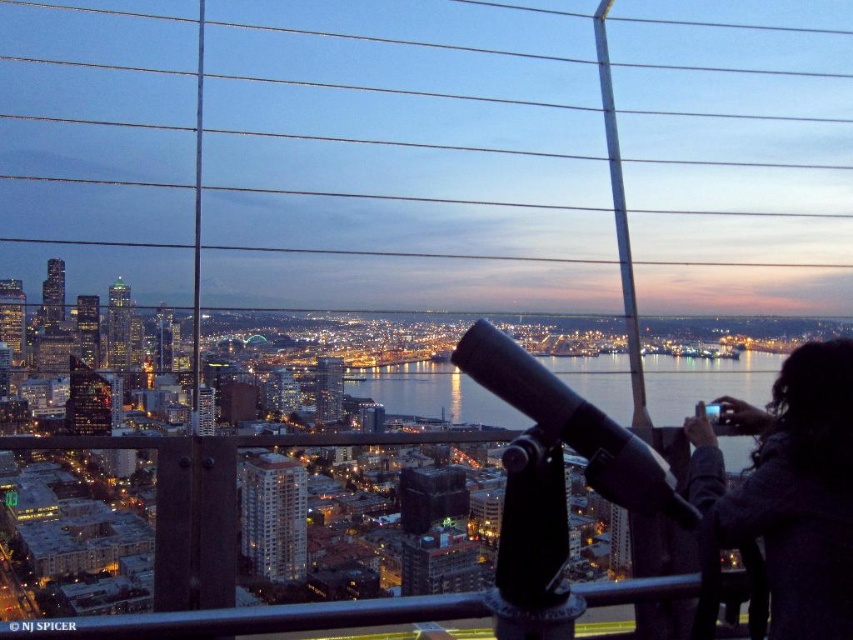
You are standing at the observation deck and want to use the black matte telescope at center to look at the city lights. However, your dark gray wool coat at lower right is blocking your view. Can you move the coat to the side to access the telescope?

The dark gray wool coat at lower right is further to the viewer than the black matte telescope at center, so moving the coat to the side would allow you to access the telescope without obstruction.

You are standing at the observation deck and want to look through the telescope to see the city lights. The telescope can only focus on one point at a time. If you first look at point (532, 371), then adjust to look at point (695, 465), will the second point be further away from you than the first?

Yes, because point (695, 465) is behind point (532, 371), meaning it is farther away from your vantage point on the observation deck.